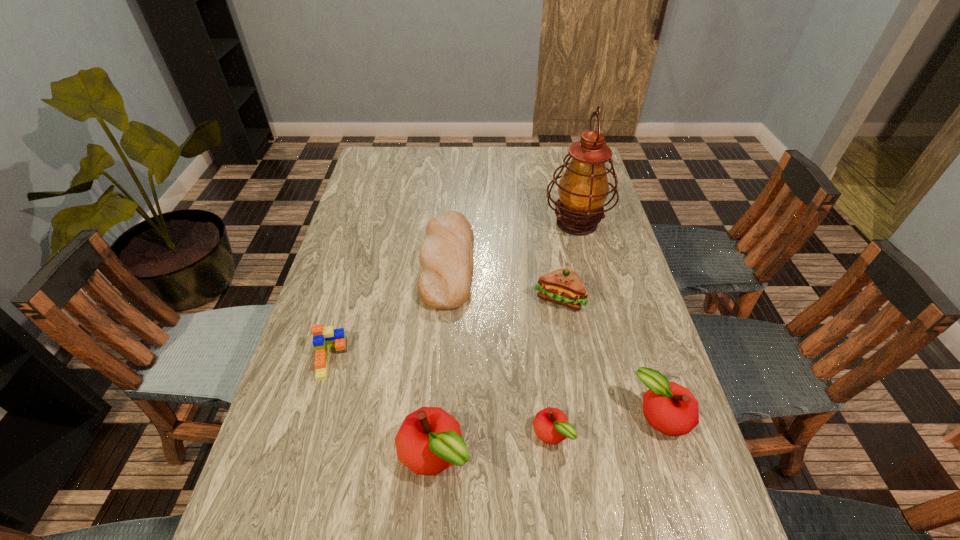
Image resolution: width=960 pixels, height=540 pixels. Identify the location of blank region between the leftmost apple and the bread. (441, 357).

Identify the location of vacant area that lies between the oil lamp and the second tallest apple. (619, 319).

Locate an element on the screen. The height and width of the screenshot is (540, 960). free spot between the leftmost object and the sandwich is located at coordinates (444, 329).

At what (x,y) coordinates should I click in order to perform the action: click on free space between the shortest apple and the sandwich. Please return your answer as a coordinate pair (x, y). The height and width of the screenshot is (540, 960). Looking at the image, I should click on (555, 366).

The image size is (960, 540). I want to click on object that is the closest to the sandwich, so click(446, 255).

The height and width of the screenshot is (540, 960). In order to click on object that is the sixth closest to the sandwich in this screenshot , I will do `click(323, 337)`.

Image resolution: width=960 pixels, height=540 pixels. In order to click on apple object that ranks as the closest to the tallest object in this screenshot , I will do `click(670, 408)`.

The width and height of the screenshot is (960, 540). I want to click on the closest apple to the rightmost apple, so pos(551,425).

I want to click on vacant point that satisfies the following two spatial constraints: 1. on the back side of the leftmost object; 2. on the right side of the bread, so click(x=357, y=261).

Find the location of a particular element. free spot that satisfies the following two spatial constraints: 1. on the back side of the leftmost apple; 2. on the left side of the second apple from right to left is located at coordinates (435, 434).